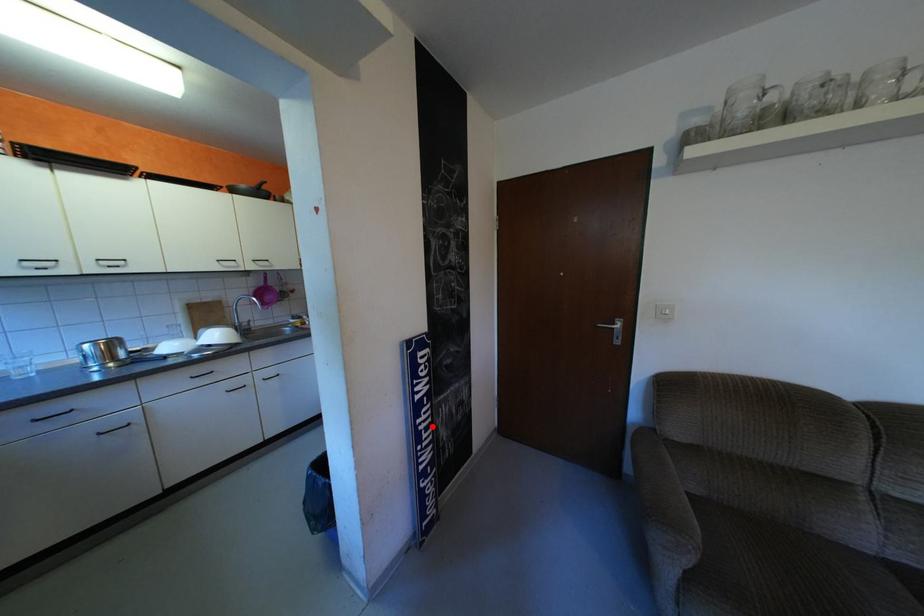
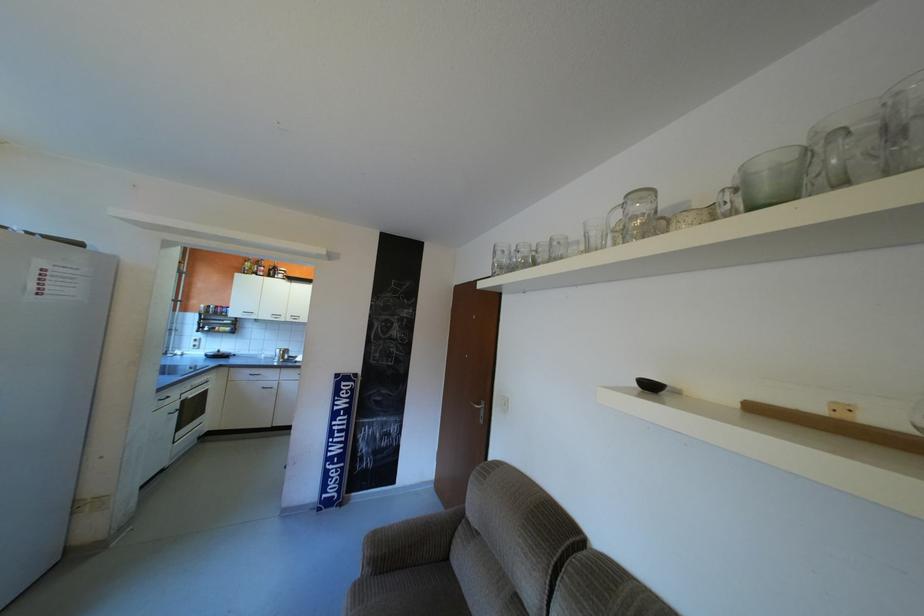
Where in the second image is the point corresponding to the highlighted location from the first image?

(346, 427)